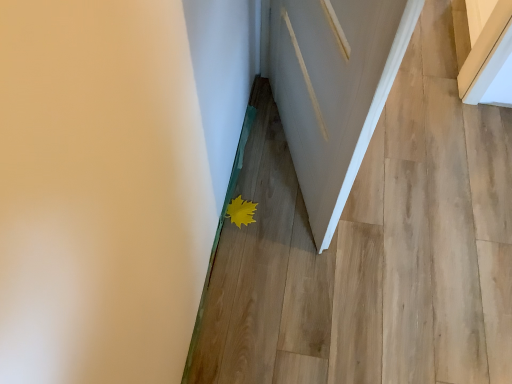
In order to click on unoccupied space behind yellow matte leaf at lower center in this screenshot , I will do `click(255, 175)`.